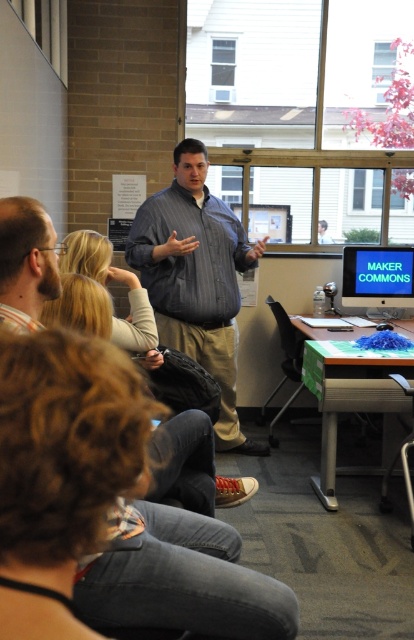
Which of these two, striped shirt at center or beige fabric shirt at upper left, stands taller?

Standing taller between the two is striped shirt at center.

Can you confirm if striped shirt at center is positioned to the right of beige fabric shirt at upper left?

Indeed, striped shirt at center is positioned on the right side of beige fabric shirt at upper left.

Find the location of `striped shirt at center`. striped shirt at center is located at coordinates (195, 278).

Is green fabric-covered table at lower right further to the viewer compared to beige fabric shirt at upper left?

Yes, green fabric-covered table at lower right is further from the viewer.

Does point (358, 400) come behind point (57, 256)?

That is True.

Which is behind, point (353, 372) or point (14, 317)?

Positioned behind is point (353, 372).

Locate an element on the screen. The image size is (414, 640). green fabric-covered table at lower right is located at coordinates (353, 404).

Can you confirm if striped shirt at center is positioned to the left of blue glossy monitor at center-right?

Correct, you'll find striped shirt at center to the left of blue glossy monitor at center-right.

Find the location of a particular element. This screenshot has width=414, height=640. striped shirt at center is located at coordinates 195,278.

Does point (170, 301) come behind point (351, 253)?

No.

Where is `striped shirt at center`? The height and width of the screenshot is (640, 414). striped shirt at center is located at coordinates (195, 278).